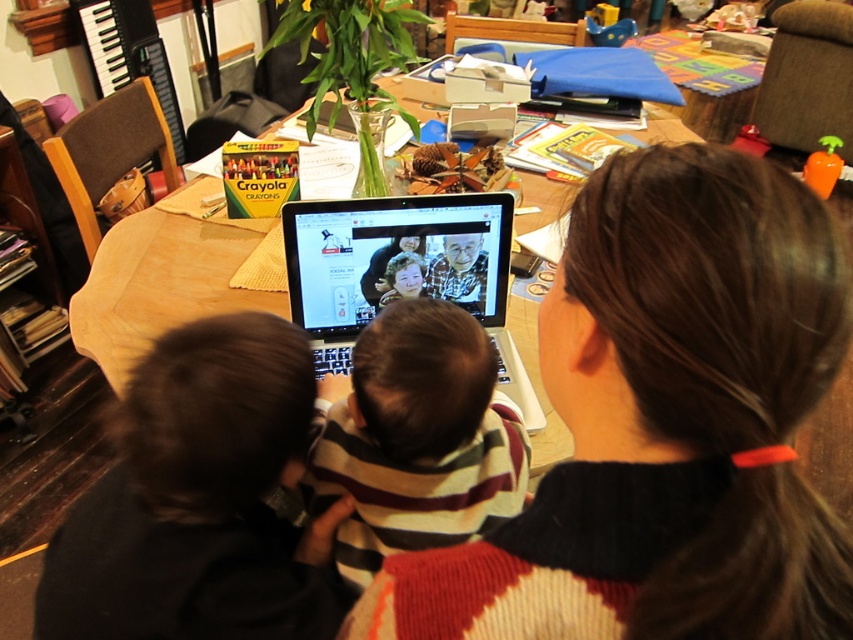
You are a photographer positioned to capture the dining table scene. You notice the striped sweater at center and the black plastic laptop at center. Which object would appear larger in your photo?

The striped sweater at center appears larger in the photo because it is closer to the viewer than the black plastic laptop at center.

You are holding a 12 inch ruler and want to measure the distance from the camera to the point at coordinates point (728, 324). Can your ruler reach that distance?

The distance of point (728, 324) from camera is 13.93 inches, so the ruler cannot reach since it is shorter than the distance.

You are a delivery robot with a 12 inch wide package. You need to place it on the table between the striped sweater at center and the black plastic laptop at center. Is there enough space?

The striped sweater at center is 11.14 inches away from the black plastic laptop at center. Since the package is 12 inches wide, there isn t enough space to place it between them.